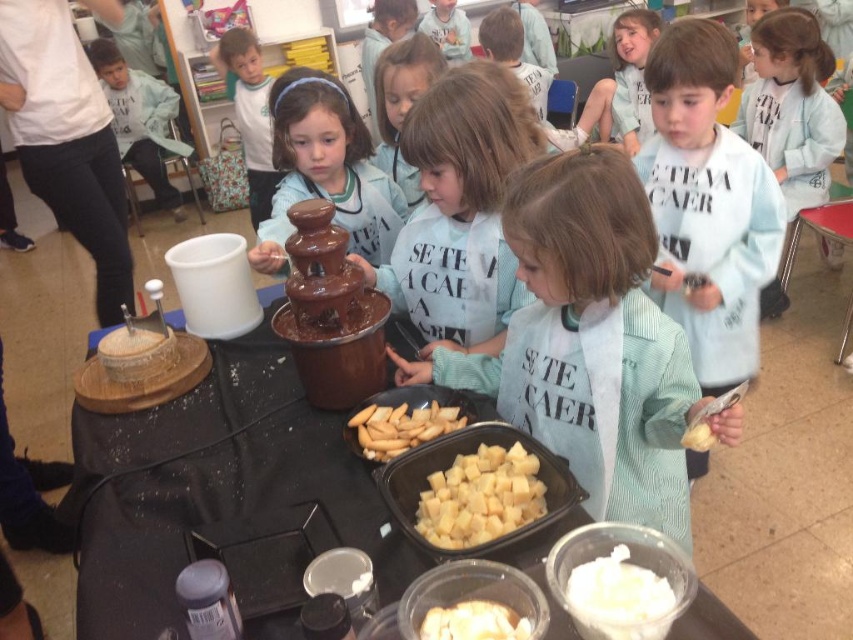
Between point (683, 497) and point (250, 49), which one is positioned in front?

Point (683, 497)

Between light blue apron at center and matte black hairband at upper center, which one has more height?

Standing taller between the two is matte black hairband at upper center.

Does point (540, 323) come farther from viewer compared to point (258, 164)?

No, (540, 323) is closer to viewer.

This screenshot has height=640, width=853. Identify the location of light blue apron at center. (589, 340).

Is matte chocolate fountain at center further to camera compared to yellow crumbly cheese at center?

Yes.

In the scene shown: Who is positioned more to the right, matte chocolate fountain at center or yellow crumbly cheese at center?

yellow crumbly cheese at center

Who is more distant from viewer, (260, 262) or (686, 435)?

The point (260, 262) is behind.

The image size is (853, 640). I want to click on matte chocolate fountain at center, so click(325, 170).

Between yellow rubbery cubes at center and matte blue shirt at center, which one has less height?

Standing shorter between the two is yellow rubbery cubes at center.

Is point (517, 525) positioned after point (393, 97)?

No.

Image resolution: width=853 pixels, height=640 pixels. I want to click on yellow rubbery cubes at center, so click(x=480, y=497).